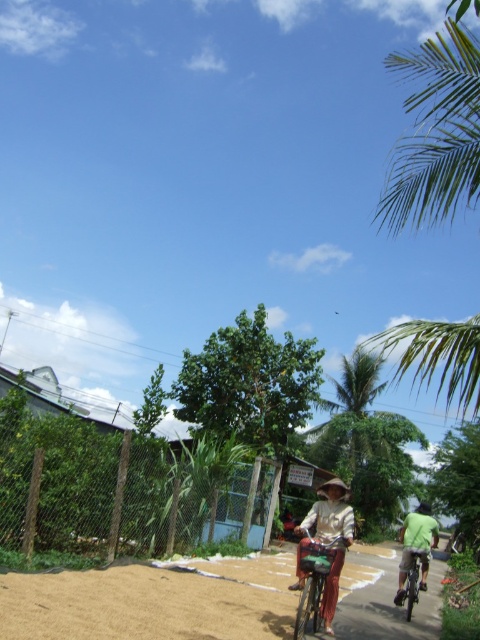
Question: Where is green leafy palm tree at upper right located in relation to metallic silver bicycle at right in the image?

Choices:
 (A) left
 (B) right

Answer: (B)

Question: Can you confirm if green leafy palm tree at upper right is positioned below metallic silver bicycle at right?

Choices:
 (A) no
 (B) yes

Answer: (A)

Question: Which object is farther from the camera taking this photo?

Choices:
 (A) green fabric shirt at right
 (B) green leafy palm tree at upper right

Answer: (A)

Question: Based on their relative distances, which object is nearer to the brown sandy ground at lower left?

Choices:
 (A) green fabric shirt at right
 (B) green leafy palm tree at upper right
 (C) metallic silver bicycle at right
 (D) metallic silver bicycle at center

Answer: (C)

Question: Is green leafy palm tree at upper right wider than metallic silver bicycle at right?

Choices:
 (A) no
 (B) yes

Answer: (B)

Question: Among these points, which one is farthest from the camera?

Choices:
 (A) (427, 58)
 (B) (406, 554)
 (C) (51, 602)

Answer: (B)